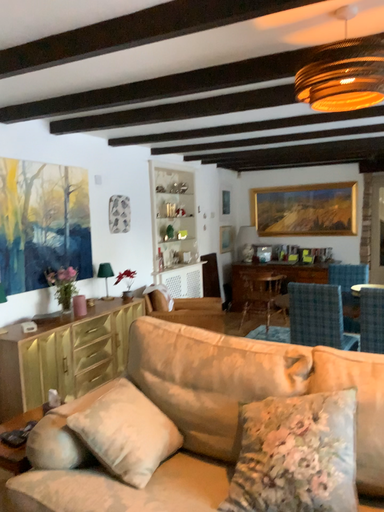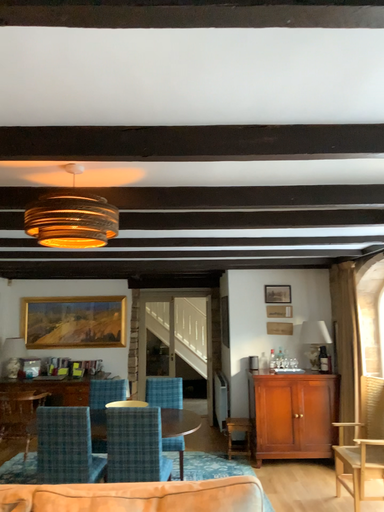
Question: How did the camera likely rotate when shooting the video?

Choices:
 (A) rotated upward
 (B) rotated downward

Answer: (A)